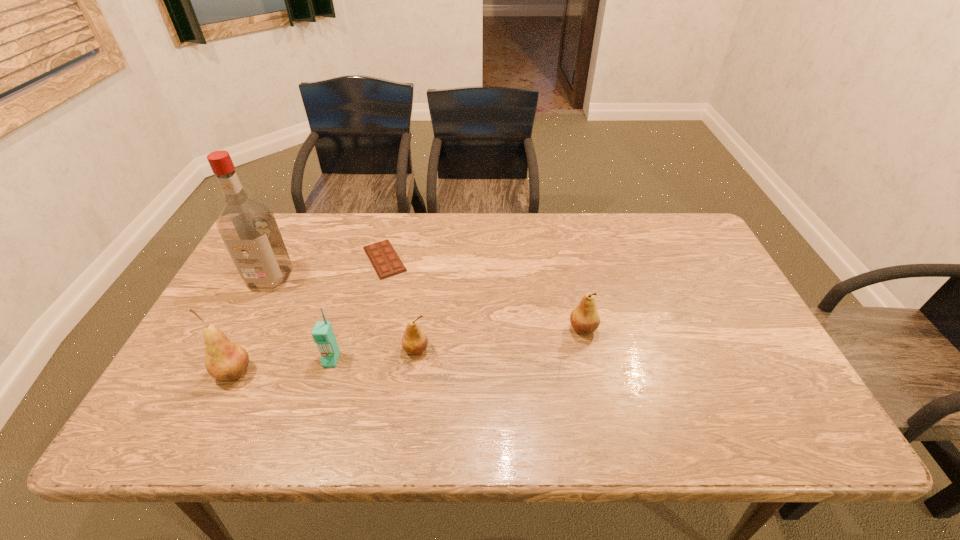
You are a GUI agent. You are given a task and a screenshot of the screen. Output one action in this format:
    pyautogui.click(x=<x>, y=<y>)
    Task: Click on the leftmost pear
    The height and width of the screenshot is (540, 960).
    Given the screenshot: What is the action you would take?
    pyautogui.click(x=224, y=360)

The image size is (960, 540). I want to click on the fifth tallest object, so click(414, 341).

Image resolution: width=960 pixels, height=540 pixels. Find the location of `the shortest pear`. the shortest pear is located at coordinates (414, 341).

The image size is (960, 540). I want to click on the rightmost object, so click(584, 318).

At what (x,y) coordinates should I click in order to perform the action: click on the second shortest pear. Please return your answer as a coordinate pair (x, y). Looking at the image, I should click on (584, 318).

Where is `the shortest object`? This screenshot has width=960, height=540. the shortest object is located at coordinates (386, 262).

You are a GUI agent. You are given a task and a screenshot of the screen. Output one action in this format:
    pyautogui.click(x=<x>, y=<y>)
    Task: Click on the liquor
    The width and height of the screenshot is (960, 540).
    Given the screenshot: What is the action you would take?
    pyautogui.click(x=248, y=228)

Where is `cellular telephone`? The image size is (960, 540). cellular telephone is located at coordinates (323, 335).

Locate an element on the screen. This screenshot has height=540, width=960. free space located 0.060m on the left of the leftmost pear is located at coordinates (190, 372).

Find the location of `free region located 0.200m on the right of the fifth tallest object`. free region located 0.200m on the right of the fifth tallest object is located at coordinates (509, 349).